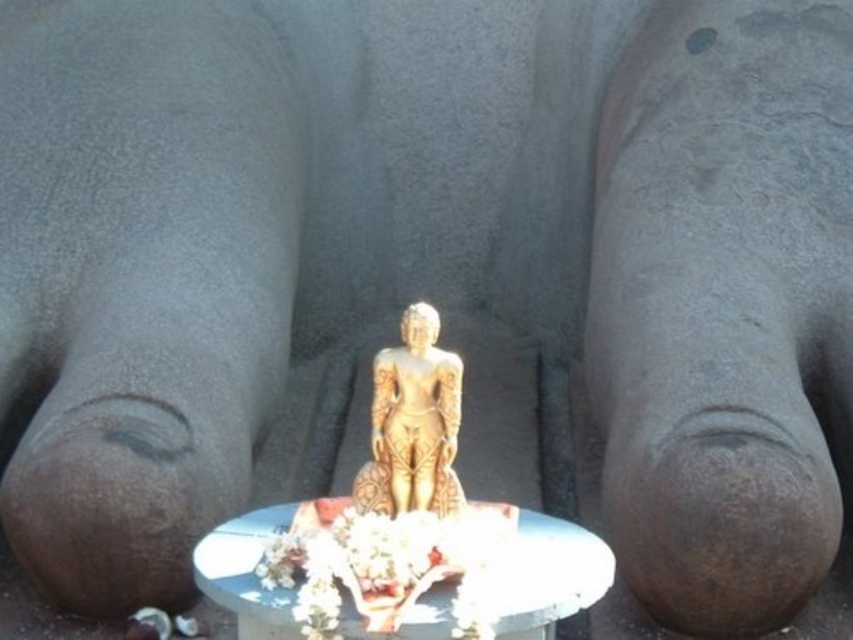
Question: Does white glossy table at center have a lesser width compared to gold polished statue at center?

Choices:
 (A) no
 (B) yes

Answer: (A)

Question: Observing the image, what is the correct spatial positioning of white glossy table at center in reference to gold polished statue at center?

Choices:
 (A) right
 (B) left

Answer: (B)

Question: Where is white glossy table at center located in relation to gold polished statue at center in the image?

Choices:
 (A) above
 (B) below

Answer: (B)